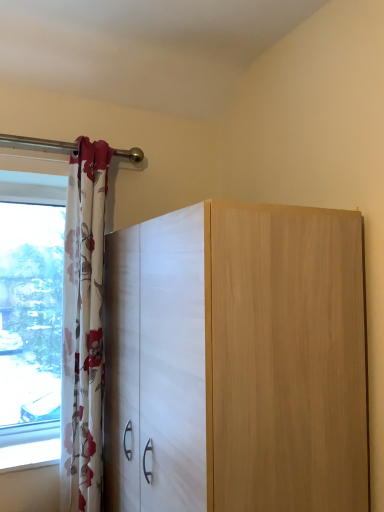
Question: Should I look upward or downward to see matte white cabinet at center?

Choices:
 (A) up
 (B) down

Answer: (B)

Question: Does floral fabric curtain at left have a lesser width compared to matte white cabinet at center?

Choices:
 (A) yes
 (B) no

Answer: (A)

Question: Does floral fabric curtain at left come in front of matte white cabinet at center?

Choices:
 (A) no
 (B) yes

Answer: (A)

Question: Is floral fabric curtain at left behind matte white cabinet at center?

Choices:
 (A) no
 (B) yes

Answer: (B)

Question: Is floral fabric curtain at left positioned far away from matte white cabinet at center?

Choices:
 (A) no
 (B) yes

Answer: (A)

Question: From a real-world perspective, is floral fabric curtain at left below matte white cabinet at center?

Choices:
 (A) no
 (B) yes

Answer: (A)

Question: Can you confirm if floral fabric curtain at left is smaller than matte white cabinet at center?

Choices:
 (A) yes
 (B) no

Answer: (A)

Question: Can you confirm if matte white cabinet at center is smaller than floral fabric curtain at left?

Choices:
 (A) yes
 (B) no

Answer: (B)

Question: Is matte white cabinet at center positioned far away from floral fabric curtain at left?

Choices:
 (A) no
 (B) yes

Answer: (A)

Question: From a real-world perspective, is matte white cabinet at center located beneath floral fabric curtain at left?

Choices:
 (A) yes
 (B) no

Answer: (A)

Question: Is matte white cabinet at center wider than floral fabric curtain at left?

Choices:
 (A) yes
 (B) no

Answer: (A)

Question: Would you say matte white cabinet at center contains floral fabric curtain at left?

Choices:
 (A) yes
 (B) no

Answer: (B)

Question: Is matte white cabinet at center in front of floral fabric curtain at left?

Choices:
 (A) yes
 (B) no

Answer: (A)

Question: From the image's perspective, relative to matte white cabinet at center, is floral fabric curtain at left above or below?

Choices:
 (A) below
 (B) above

Answer: (B)